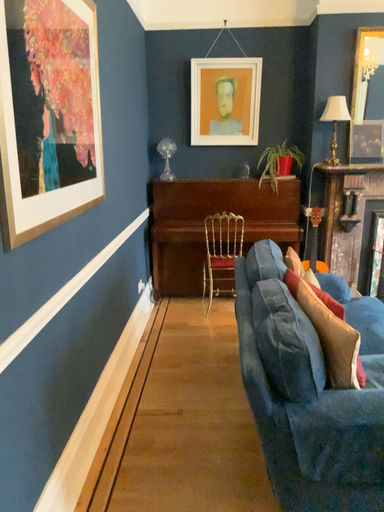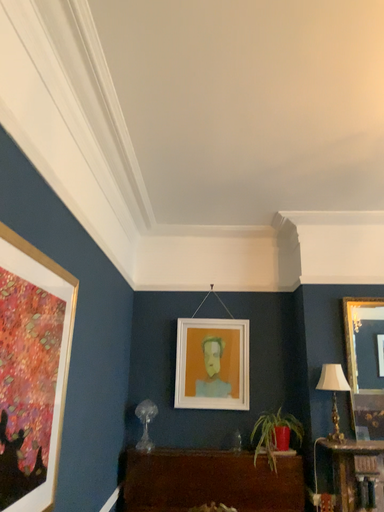
Question: Which way did the camera rotate in the video?

Choices:
 (A) rotated downward
 (B) rotated upward

Answer: (B)